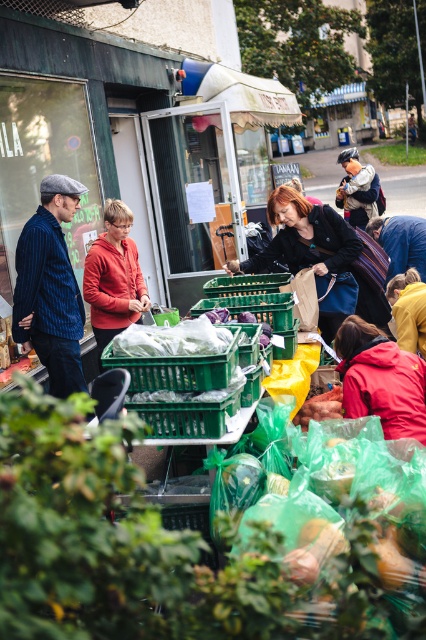
You are a vendor at the market and need to reach the smooth brown potato at center to show it to a customer. You are currently standing in front of the orange fleece jacket at center. Can you directly access the potato without moving the jacket?

The orange fleece jacket at center is further to the viewer than smooth brown potato at center, meaning the potato is behind the jacket. Therefore, you cannot directly access the smooth brown potato at center without moving the orange fleece jacket at center.

In the market scene, you notice two people wearing distinctive jackets. The first person is wearing a blue striped blazer at left, and the second is wearing a red matte jacket at lower right. If you were to compare their jackets, which one is wider?

The blue striped blazer at left is wider than the red matte jacket at lower right.